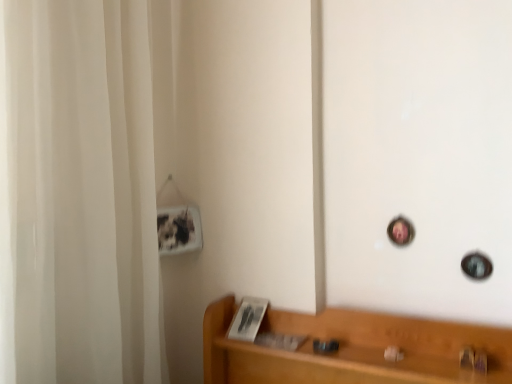
Question: Looking at their shapes, would you say white fabric shower curtain at left is wider or thinner than light brown wood shelf at lower right?

Choices:
 (A) thin
 (B) wide

Answer: (B)

Question: Considering the positions of point (144, 244) and point (351, 367), is point (144, 244) closer or farther from the camera than point (351, 367)?

Choices:
 (A) closer
 (B) farther

Answer: (B)

Question: Which object is the closest to the metallic gold door handle at lower right?

Choices:
 (A) white fabric shower curtain at left
 (B) light brown wood shelf at lower right

Answer: (B)

Question: Estimate the real-world distances between objects in this image. Which object is farther from the light brown wood shelf at lower right?

Choices:
 (A) white fabric shower curtain at left
 (B) metallic gold door handle at lower right

Answer: (A)